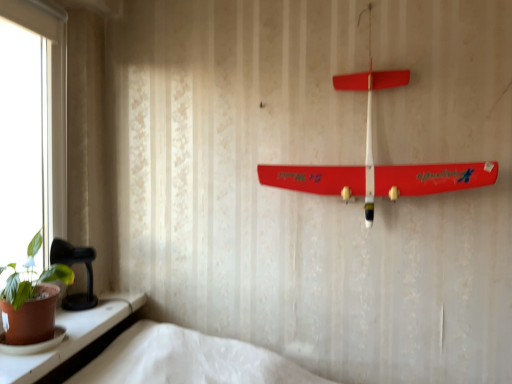
At what (x,y) coordinates should I click in order to perform the action: click on free area below green matte houseplant at lower left (from a real-world perspective). Please return your answer as a coordinate pair (x, y). Looking at the image, I should click on (45, 348).